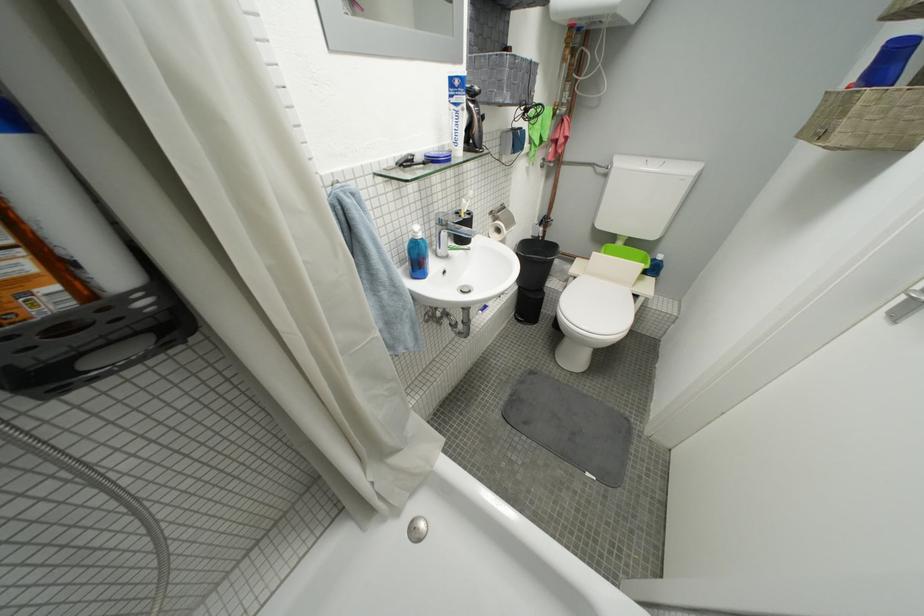
Locate an element on the screen. This screenshot has width=924, height=616. bathtub drain stopper is located at coordinates (417, 529).